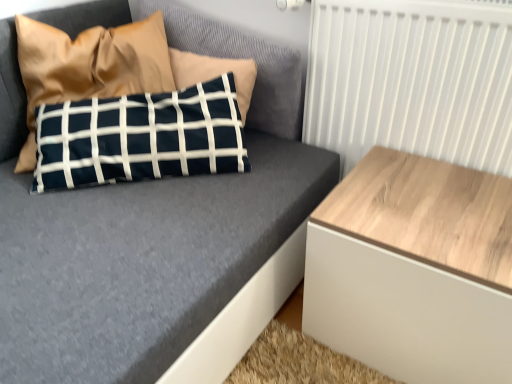
Question: Is white wood radiator at upper right to the left or to the right of light wood/texture side table at right in the image?

Choices:
 (A) right
 (B) left

Answer: (B)

Question: From the image's perspective, is white wood radiator at upper right located above or below light wood/texture side table at right?

Choices:
 (A) below
 (B) above

Answer: (B)

Question: Estimate the real-world distances between objects in this image. Which object is farther from the navy blue fabric pillow at upper left?

Choices:
 (A) white wood radiator at upper right
 (B) light wood/texture side table at right

Answer: (B)

Question: Estimate the real-world distances between objects in this image. Which object is farther from the light wood/texture side table at right?

Choices:
 (A) white wood radiator at upper right
 (B) navy blue fabric pillow at upper left

Answer: (B)